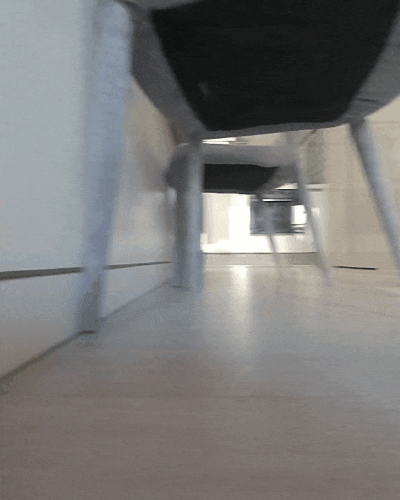
The height and width of the screenshot is (500, 400). In order to click on baseboard in this screenshot , I will do `click(31, 285)`, `click(63, 367)`.